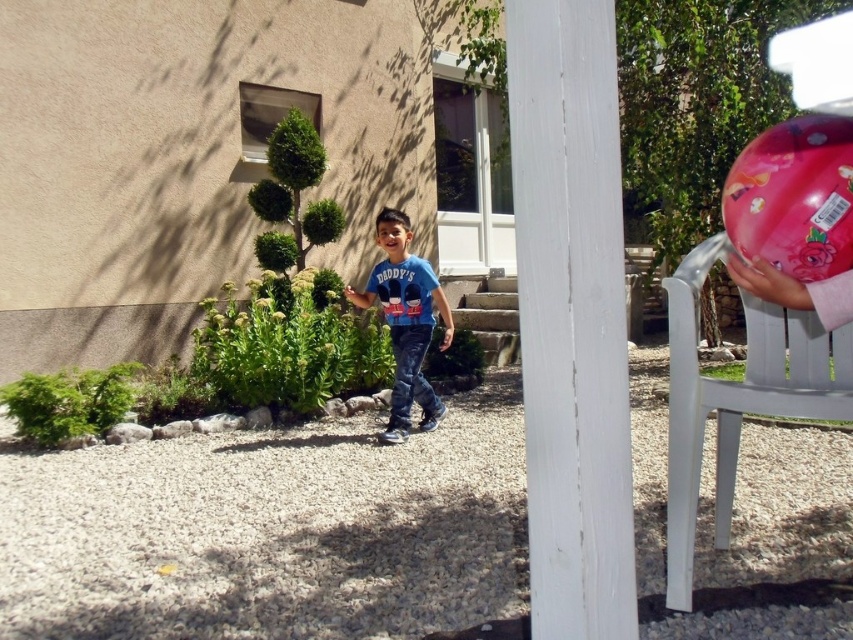
Is point (682, 371) positioned before point (390, 337)?

Yes, point (682, 371) is closer to viewer.

Does white plastic chair at right have a lesser height compared to blue denim jeans at center?

Indeed, white plastic chair at right has a lesser height compared to blue denim jeans at center.

This screenshot has width=853, height=640. I want to click on white plastic chair at right, so click(735, 400).

Can you confirm if white plastic chair at right is positioned above shiny pink helmet at upper right?

Incorrect, white plastic chair at right is not positioned above shiny pink helmet at upper right.

Which is behind, point (799, 394) or point (758, 154)?

Point (799, 394)

This screenshot has width=853, height=640. Identify the location of white plastic chair at right. (735, 400).

Can you confirm if shiny pink helmet at upper right is positioned to the left of blue denim jeans at center?

No, shiny pink helmet at upper right is not to the left of blue denim jeans at center.

In the scene shown: Does shiny pink helmet at upper right have a larger size compared to blue denim jeans at center?

No.

The image size is (853, 640). Identify the location of shiny pink helmet at upper right. (793, 196).